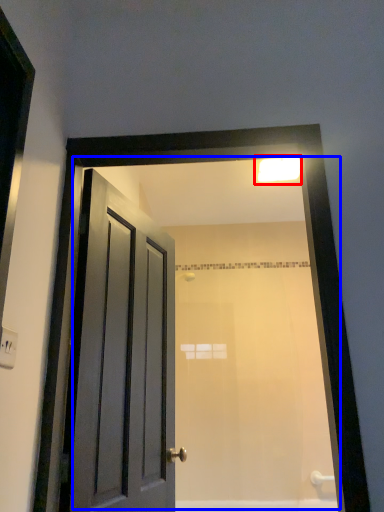
Question: Which point is closer to the camera, light fixture (highlighted by a red box) or mirror (highlighted by a blue box)?

Choices:
 (A) light fixture
 (B) mirror

Answer: (B)